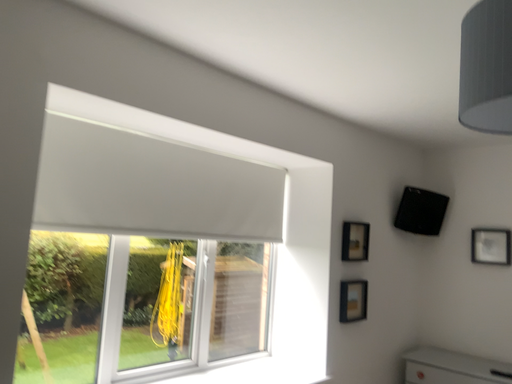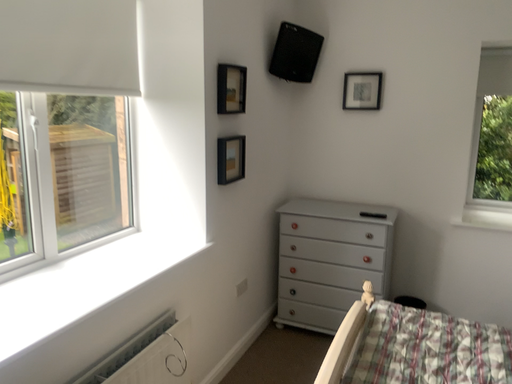
Question: How did the camera likely rotate when shooting the video?

Choices:
 (A) rotated left
 (B) rotated right

Answer: (B)